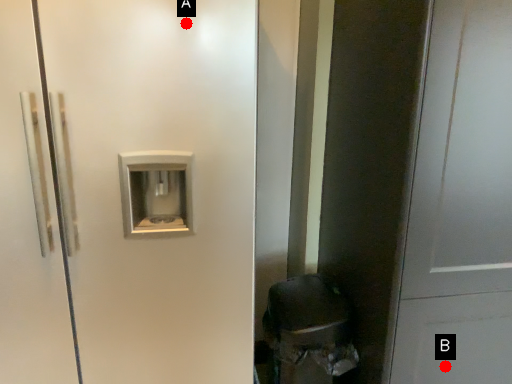
Question: Two points are circled on the image, labeled by A and B beside each circle. Which point is closer to the camera taking this photo?

Choices:
 (A) A is closer
 (B) B is closer

Answer: (A)